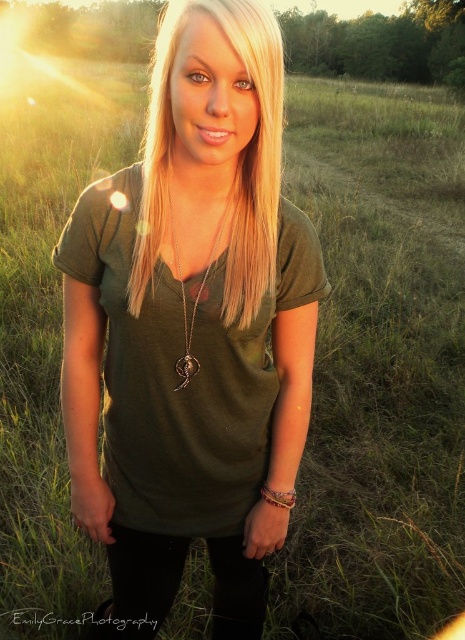
Does olive green t-shirt at center appear on the left side of blonde silky hair at center?

Incorrect, olive green t-shirt at center is not on the left side of blonde silky hair at center.

In the scene shown: Between olive green t-shirt at center and blonde silky hair at center, which one appears on the left side from the viewer's perspective?

Positioned to the left is blonde silky hair at center.

Identify the location of olive green t-shirt at center. This screenshot has width=465, height=640. (192, 330).

Is the position of blonde silky hair at center more distant than that of silver metallic pendant at center?

No, blonde silky hair at center is closer to the viewer.

Is blonde silky hair at center smaller than silver metallic pendant at center?

No.

Locate an element on the screen. The image size is (465, 640). blonde silky hair at center is located at coordinates (237, 163).

Who is positioned more to the right, olive green t-shirt at center or silver metallic pendant at center?

From the viewer's perspective, silver metallic pendant at center appears more on the right side.

Can you confirm if olive green t-shirt at center is shorter than silver metallic pendant at center?

No.

Is point (228, 289) positioned before point (227, 227)?

Yes, point (228, 289) is closer to viewer.

The height and width of the screenshot is (640, 465). What are the coordinates of `olive green t-shirt at center` in the screenshot? It's located at (192, 330).